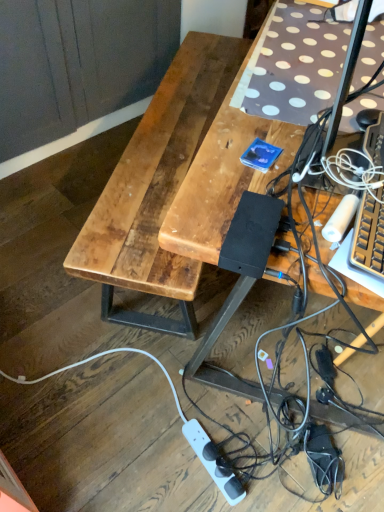
You are a GUI agent. You are given a task and a screenshot of the screen. Output one action in this format:
    pyautogui.click(x=<x>, y=<y>)
    Task: Click on the empty space that is to the right of white plastic power strip at lower center
    The width and height of the screenshot is (384, 512).
    Given the screenshot: What is the action you would take?
    pyautogui.click(x=267, y=457)